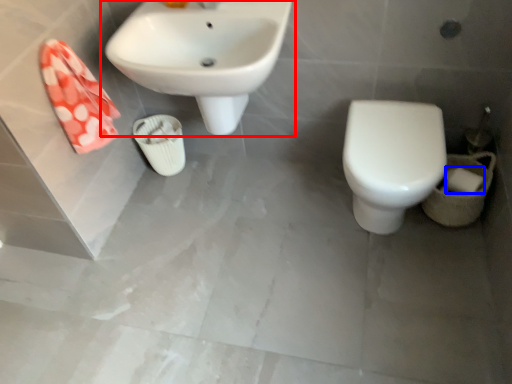
Question: Which point is further to the camera, sink (highlighted by a red box) or toilet paper (highlighted by a blue box)?

Choices:
 (A) sink
 (B) toilet paper

Answer: (B)